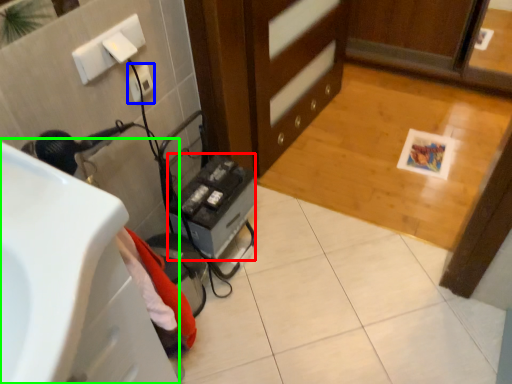
Question: Estimate the real-world distances between objects in this image. Which object is closer to appliance (highlighted by a red box), electric outlet (highlighted by a blue box) or sink (highlighted by a green box)?

Choices:
 (A) electric outlet
 (B) sink

Answer: (A)